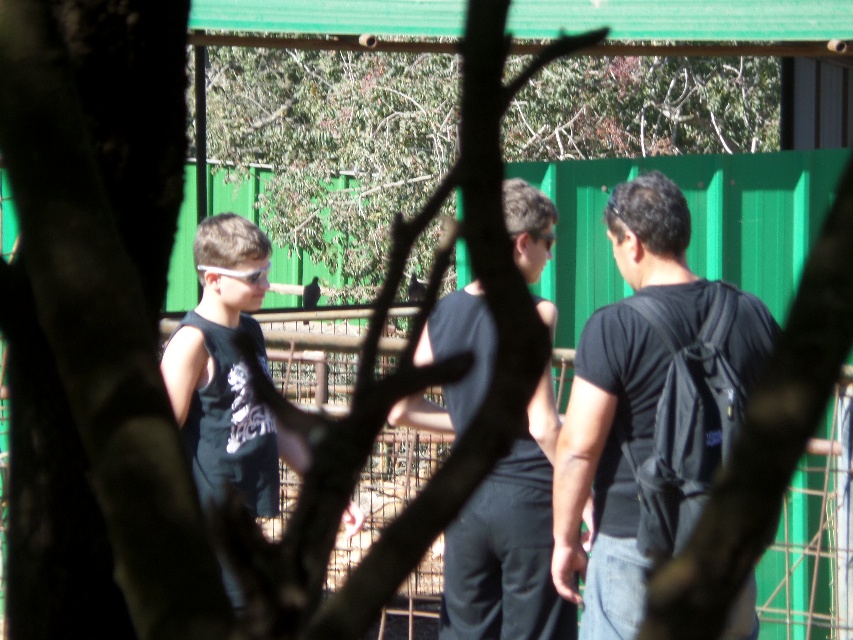
Describe the element at coordinates (508, 544) in the screenshot. I see `black matte tank top at center` at that location.

Locate an element on the screen. black matte tank top at center is located at coordinates [x=508, y=544].

Which of these two, black matte backpack at right or black matte tank top at left, stands shorter?

Standing shorter between the two is black matte tank top at left.

From the picture: Does black matte backpack at right come in front of black matte tank top at left?

Yes, black matte backpack at right is closer to the viewer.

What do you see at coordinates (647, 404) in the screenshot? I see `black matte backpack at right` at bounding box center [647, 404].

Locate an element on the screen. This screenshot has height=640, width=853. black matte backpack at right is located at coordinates 647,404.

Who is higher up, black matte backpack at right or black matte tank top at center?

black matte tank top at center is higher up.

Can you confirm if black matte backpack at right is taller than black matte tank top at center?

No, black matte backpack at right is not taller than black matte tank top at center.

Identify the location of black matte backpack at right. (647, 404).

Where is `black matte backpack at right`? black matte backpack at right is located at coordinates (647, 404).